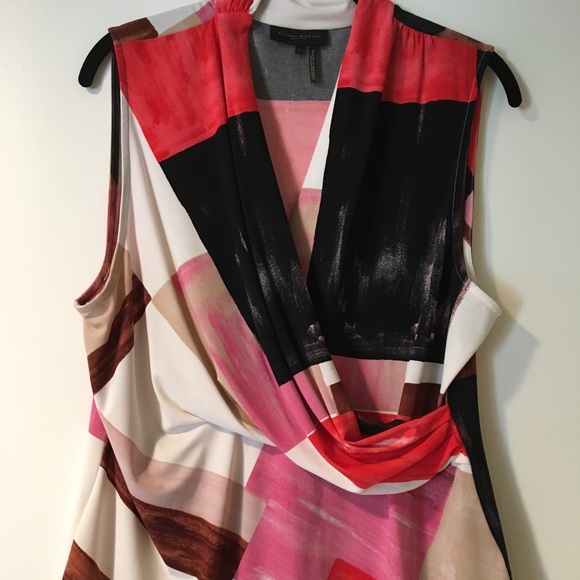
This screenshot has width=580, height=580. I want to click on the left hanger, so click(90, 49).